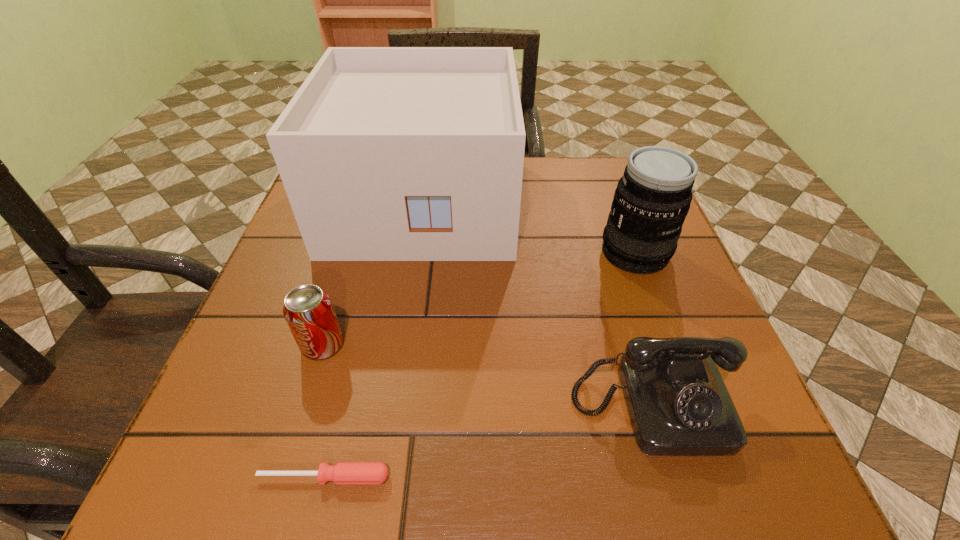
What are the coordinates of `vacant region that satisfies the following two spatial constraints: 1. on the back side of the second tallest object; 2. on the right side of the soda can` in the screenshot? It's located at (351, 253).